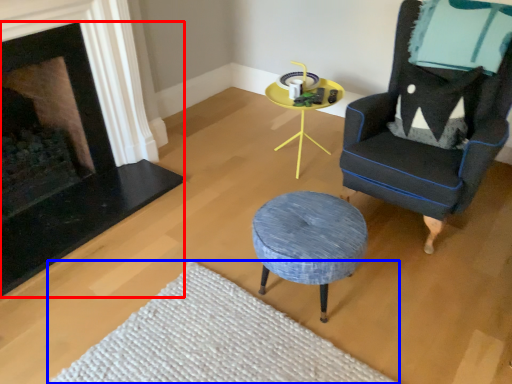
Question: Which object appears farthest to the camera in this image, fireplace (highlighted by a red box) or plain (highlighted by a blue box)?

Choices:
 (A) fireplace
 (B) plain

Answer: (A)